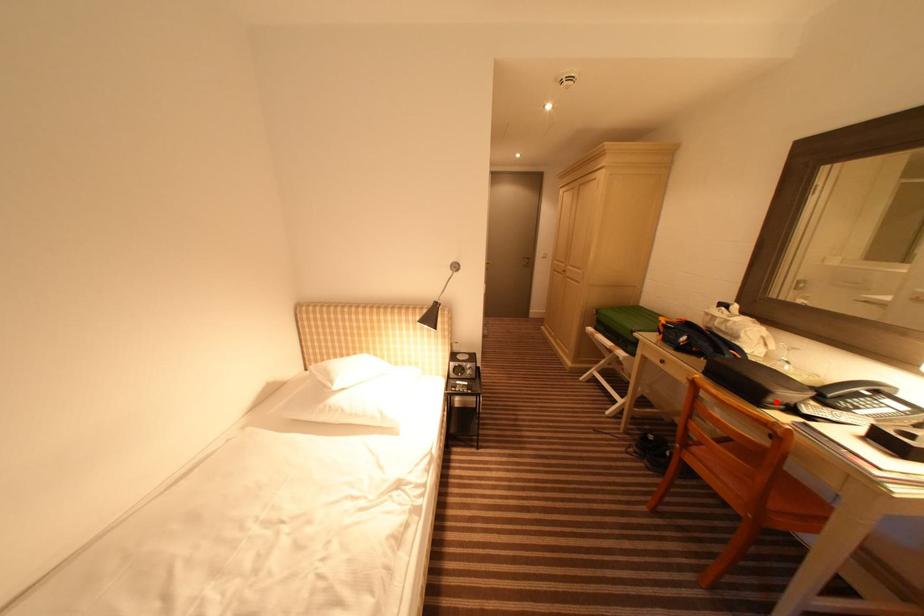
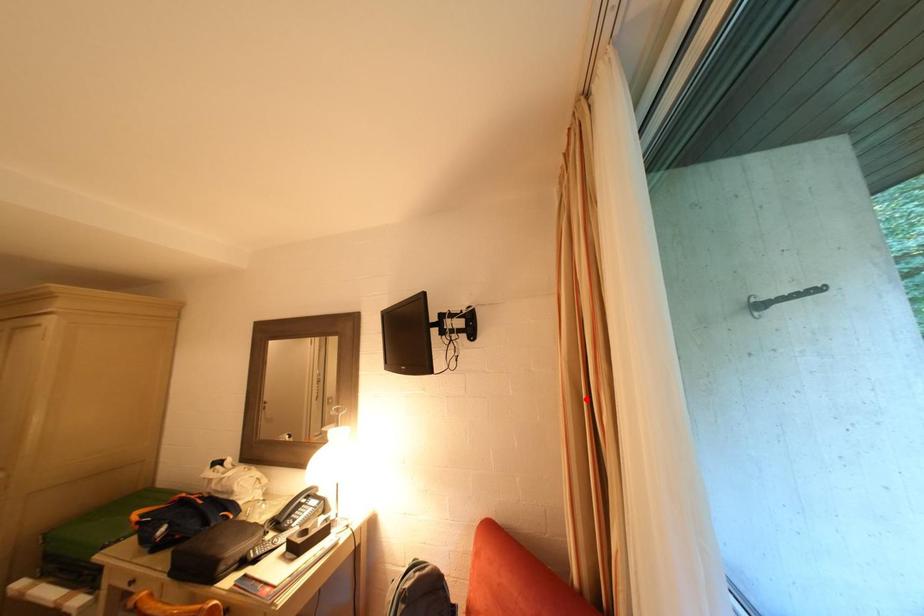
I am providing you with two images of the same scene from different viewpoints. A red point is marked on the first image and another point is marked on the second image. Is the marked point in image1 the same physical position as the marked point in image2?

No